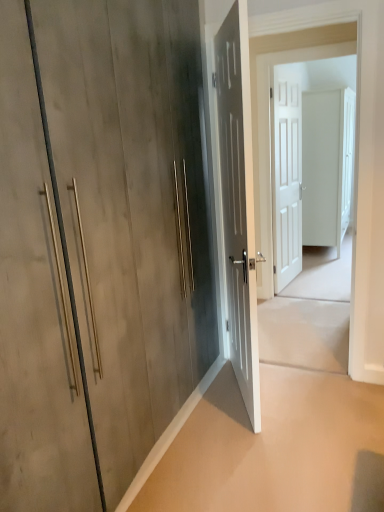
Question: Is beige concrete at lower right turned away from white matte door at center, marked as the first door in a back-to-front arrangement?

Choices:
 (A) yes
 (B) no

Answer: (B)

Question: Is beige concrete at lower right smaller than white matte door at center, acting as the 4th door starting from the left?

Choices:
 (A) yes
 (B) no

Answer: (A)

Question: Does beige concrete at lower right have a larger size compared to white matte door at center, which ranks as the 4th door in front-to-back order?

Choices:
 (A) no
 (B) yes

Answer: (A)

Question: Is beige concrete at lower right not inside white matte door at center, acting as the 4th door starting from the left?

Choices:
 (A) no
 (B) yes

Answer: (B)

Question: Considering the relative sizes of beige concrete at lower right and white matte door at center, marked as the first door in a back-to-front arrangement, in the image provided, is beige concrete at lower right taller than white matte door at center, marked as the first door in a back-to-front arrangement,?

Choices:
 (A) yes
 (B) no

Answer: (B)

Question: Does beige concrete at lower right turn towards white matte door at center, which ranks as the 4th door in front-to-back order?

Choices:
 (A) no
 (B) yes

Answer: (A)

Question: Could you tell me if matte gray door at center, which appears as the 3th door when viewed from the right, is facing matte wood door at center, which is counted as the first door, starting from the front?

Choices:
 (A) no
 (B) yes

Answer: (A)

Question: Is matte gray door at center, which is the 2th door in front-to-back order, not inside matte wood door at center, the first door positioned from the left?

Choices:
 (A) yes
 (B) no

Answer: (A)

Question: Does matte gray door at center, which is the 2th door in front-to-back order, have a smaller size compared to matte wood door at center, arranged as the fourth door when viewed from the right?

Choices:
 (A) no
 (B) yes

Answer: (B)

Question: Is matte gray door at center, which appears as the 3th door when viewed from the right, not near matte wood door at center, arranged as the fourth door when viewed from the right?

Choices:
 (A) no
 (B) yes

Answer: (A)

Question: Is matte gray door at center, which appears as the 3th door when viewed from the right, positioned with its back to matte wood door at center, arranged as the fourth door when viewed from the right?

Choices:
 (A) yes
 (B) no

Answer: (A)

Question: Does matte gray door at center, positioned as the 3th door in back-to-front order, come behind matte wood door at center, the first door positioned from the left?

Choices:
 (A) yes
 (B) no

Answer: (A)

Question: Is beige concrete at lower right touching matte wood door at center, which is counted as the first door, starting from the front?

Choices:
 (A) yes
 (B) no

Answer: (B)